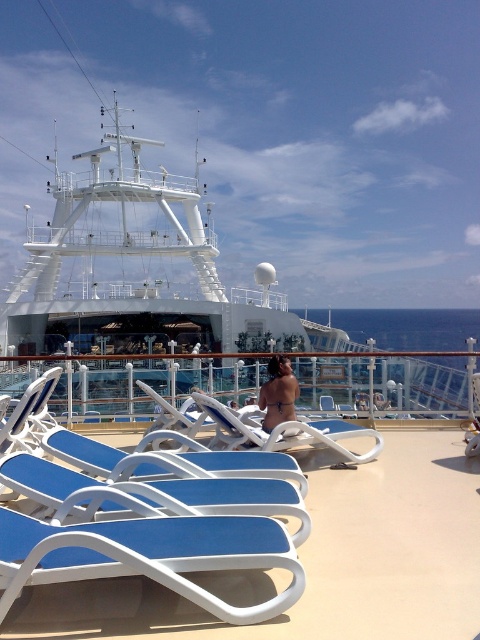
Does point (252, 372) lie behind point (289, 390)?

Yes, it is behind point (289, 390).

Does white plastic rail at center have a lesser height compared to smooth tan skin at center?

In fact, white plastic rail at center may be taller than smooth tan skin at center.

Which is behind, point (432, 410) or point (276, 400)?

The point (432, 410) is more distant.

Where is `white plastic rail at center`? white plastic rail at center is located at coordinates (132, 380).

Does blue plastic beach chair at lower left appear over smooth tan skin at center?

Incorrect, blue plastic beach chair at lower left is not positioned above smooth tan skin at center.

Who is shorter, blue plastic beach chair at lower left or smooth tan skin at center?

Standing shorter between the two is blue plastic beach chair at lower left.

Where is `blue plastic beach chair at lower left`? The width and height of the screenshot is (480, 640). blue plastic beach chair at lower left is located at coordinates (157, 493).

Is point (388, 374) behind point (346, 451)?

Yes, it is.

Is white plastic rail at center thinner than blue plastic beach chair at center?

No.

What are the coordinates of `white plastic rail at center` in the screenshot? It's located at click(132, 380).

Where is `white plastic rail at center`? white plastic rail at center is located at coordinates (132, 380).